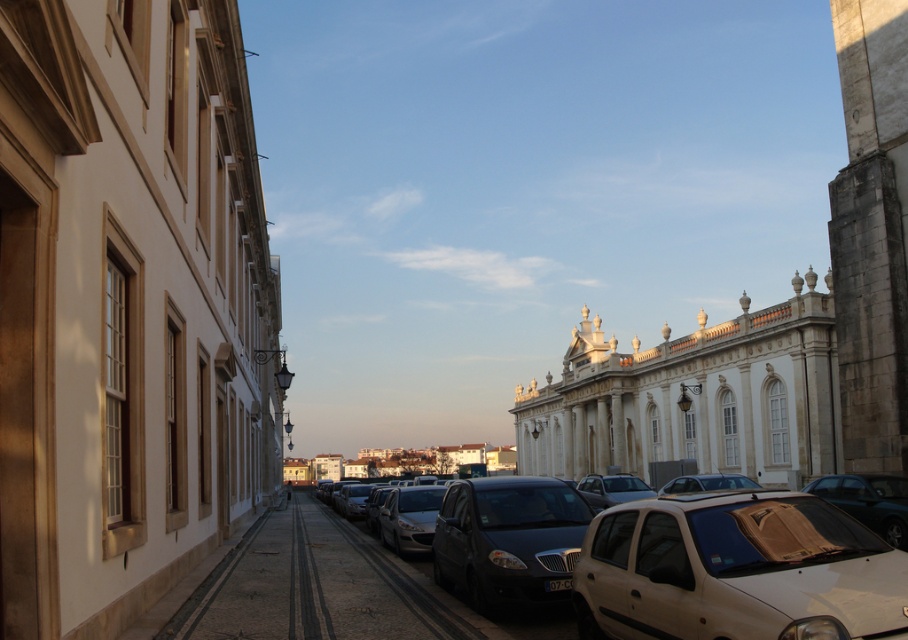
Identify the location of matte black car at center. (731, 570).

Which of these two, matte black car at center or shiny black sedan at center, stands taller?

matte black car at center is taller.

Is point (630, 604) positioned after point (439, 547)?

No, (630, 604) is closer to viewer.

Identify the location of matte black car at center. (731, 570).

Who is shorter, smooth stone tower at right or matte black car at lower right?

matte black car at lower right is shorter.

Describe the element at coordinates (871, 234) in the screenshot. This screenshot has height=640, width=908. I see `smooth stone tower at right` at that location.

Image resolution: width=908 pixels, height=640 pixels. In order to click on smooth stone tower at right in this screenshot , I will do `click(871, 234)`.

Is shiny black sedan at center bigger than matte black car at lower right?

Yes.

Who is taller, shiny black sedan at center or matte black car at lower right?

With more height is shiny black sedan at center.

This screenshot has height=640, width=908. What are the coordinates of `shiny black sedan at center` in the screenshot? It's located at (508, 540).